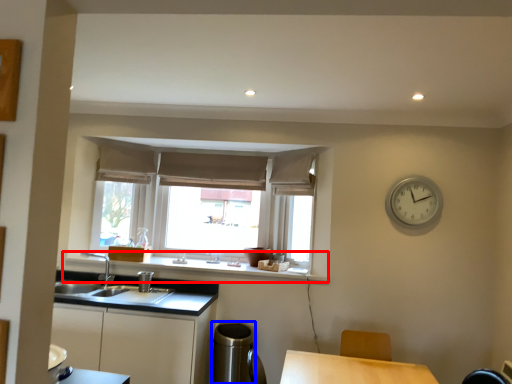
Question: Which of the following is the closest to the observer, window sill (highlighted by a red box) or appliance (highlighted by a blue box)?

Choices:
 (A) window sill
 (B) appliance

Answer: (B)